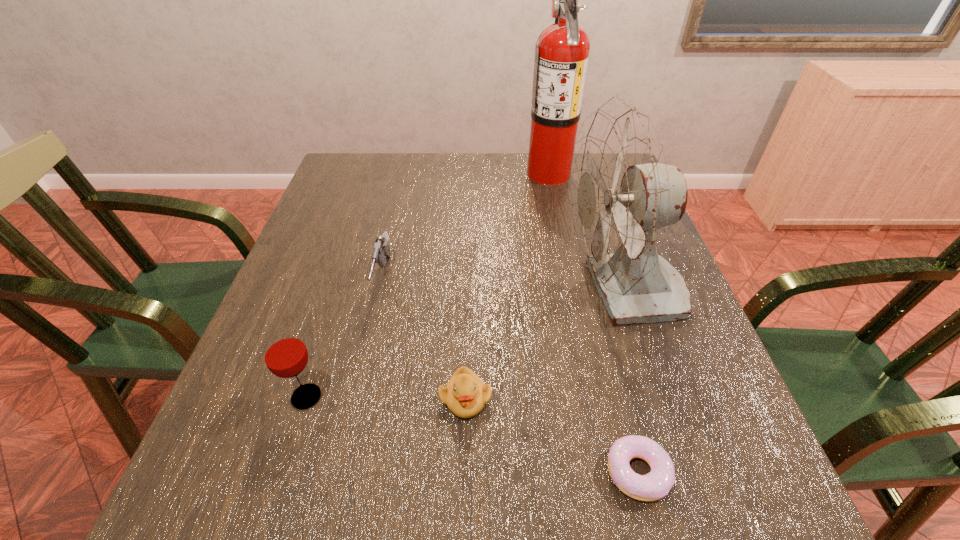
Where is `vacant space situated on the left of the doughnut`? The height and width of the screenshot is (540, 960). vacant space situated on the left of the doughnut is located at coordinates (529, 471).

Find the location of a particular element. Image resolution: width=960 pixels, height=540 pixels. object at the far edge is located at coordinates (561, 57).

Where is `object that is positioned at the near edge`? This screenshot has height=540, width=960. object that is positioned at the near edge is located at coordinates (655, 485).

Where is `object that is positioned at the left edge`? The width and height of the screenshot is (960, 540). object that is positioned at the left edge is located at coordinates (285, 354).

I want to click on fan that is positioned at the right edge, so click(623, 195).

Locate an element on the screen. doughnut that is positioned at the right edge is located at coordinates (655, 485).

Locate an element on the screen. object that is at the near right corner is located at coordinates (655, 485).

Where is `vacant area at the far edge of the desktop`? This screenshot has width=960, height=540. vacant area at the far edge of the desktop is located at coordinates (421, 182).

This screenshot has height=540, width=960. In order to click on vacant space at the left edge of the desktop in this screenshot , I will do `click(324, 207)`.

Where is `free spot at the right edge of the desktop`? This screenshot has width=960, height=540. free spot at the right edge of the desktop is located at coordinates (707, 397).